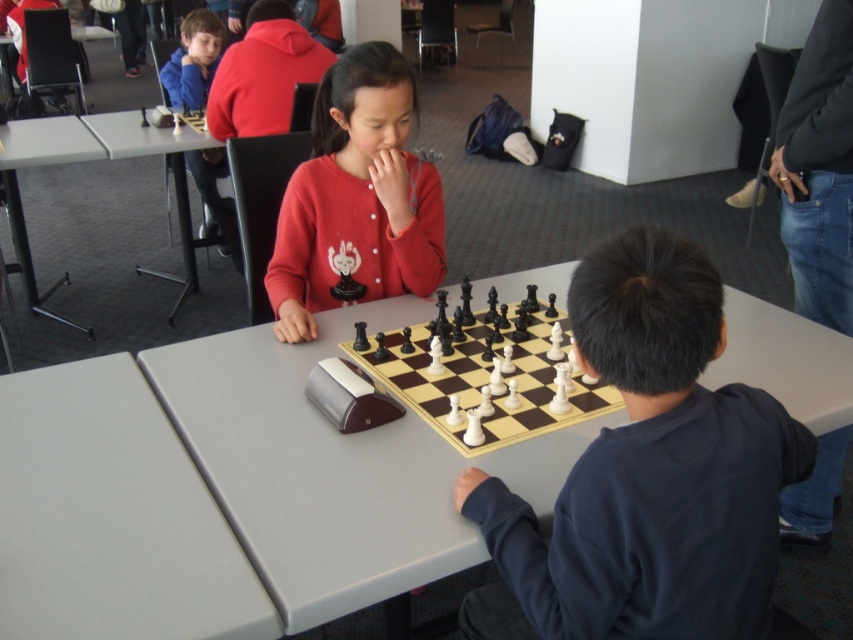
You are a photographer trying to capture both children in a single shot. Given that the dark blue sweatshirt at right and the matte red sweater at center are visible, which child should you position closer to the camera to ensure both are fully in frame?

Since the dark blue sweatshirt at right is larger in size than the matte red sweater at center, you should position the child in the dark blue sweatshirt at right closer to the camera. This will help balance their sizes in the photo so both are fully visible in the frame.

From the picture: You are a photographer setting up for a chess tournament. You need to position a camera to capture both the gray plastic table at lower left and the gray plastic table at upper left in the frame. Which table should you place the camera closer to in order to ensure both are visible without zooming?

You should place the camera closer to the gray plastic table at lower left since it is positioned to the left of the gray plastic table at upper left, allowing both to be captured in the frame without zooming.

You are a chess player who wants to place a new piece on the board. The chessboard is located on the gray plastic table at upper left. Where should you place the new piece in relation to the black glossy chess set at center?

The black glossy chess set at center is positioned on the right side of gray plastic table at upper left, so the new piece should be placed on the right side of the gray plastic table at upper left where the chess set is located.